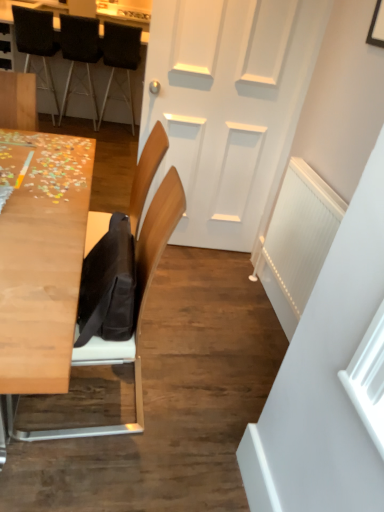
Find the location of a particular element. vacant area to the right of light wood table at left, the 2th table viewed from the top is located at coordinates (201, 367).